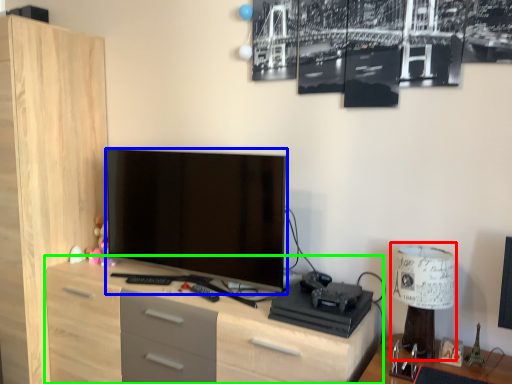
Question: Estimate the real-world distances between objects in this image. Which object is farther from table lamp (highlighted by a red box), television (highlighted by a blue box) or chest of drawers (highlighted by a green box)?

Choices:
 (A) television
 (B) chest of drawers

Answer: (A)